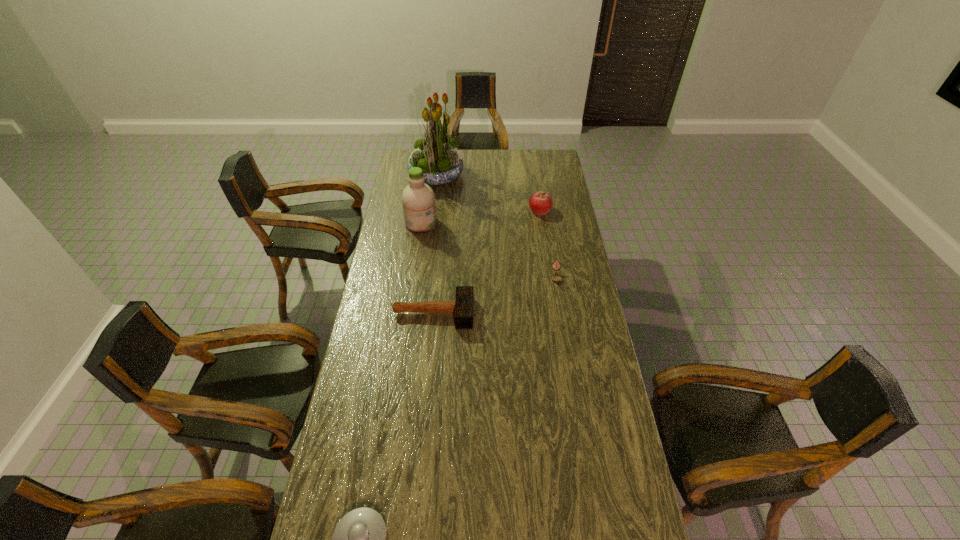
Identify the location of the farthest object. (437, 155).

Identify the location of the tallest object. (437, 155).

The image size is (960, 540). I want to click on the fifth shortest object, so click(x=418, y=199).

Identify the location of the fourth shortest object. This screenshot has width=960, height=540. (540, 203).

At what (x,y) coordinates should I click in order to perform the action: click on the second nearest object. Please return your answer as a coordinate pair (x, y). The width and height of the screenshot is (960, 540). Looking at the image, I should click on (463, 305).

Locate an element on the screen. This screenshot has width=960, height=540. the third shortest object is located at coordinates (463, 305).

Where is `compass`? The height and width of the screenshot is (540, 960). compass is located at coordinates 556,278.

At what (x,y) coordinates should I click in order to perform the action: click on the fifth tallest object. Please return your answer as a coordinate pair (x, y). Looking at the image, I should click on (556, 278).

Identify the location of vacant space located 0.120m on the front-facing side of the tallest object. (486, 174).

You are a GUI agent. You are given a task and a screenshot of the screen. Output one action in this format:
    pyautogui.click(x=<x>, y=<y>)
    Task: Click on the vacant space situated on the front label of the second tallest object
    This screenshot has width=960, height=540.
    Given the screenshot: What is the action you would take?
    pyautogui.click(x=455, y=223)